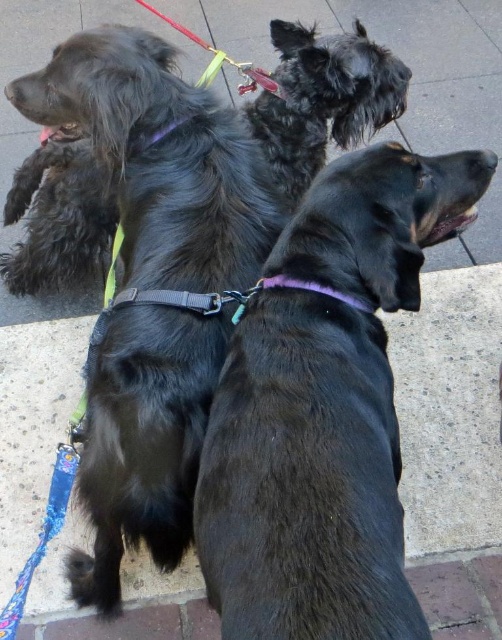
Question: Does shiny black fur at upper left have a lesser width compared to purple fabric neckband at center?

Choices:
 (A) yes
 (B) no

Answer: (B)

Question: Which point appears closest to the camera in this image?

Choices:
 (A) (310, 284)
 (B) (210, 45)
 (C) (326, 358)
 (D) (312, 51)

Answer: (C)

Question: Which point appears closest to the camera in this image?

Choices:
 (A) (228, 394)
 (B) (35, 168)
 (C) (319, 288)
 (D) (209, 72)

Answer: (A)

Question: Which point is closer to the camera taking this photo?

Choices:
 (A) (321, 241)
 (B) (168, 20)
 (C) (282, 76)
 (D) (355, 298)

Answer: (A)

Question: Is black matte dog at center to the left of shiny black fur at upper left from the viewer's perspective?

Choices:
 (A) yes
 (B) no

Answer: (B)

Question: Does black matte dog at center appear under yellow fabric leash at upper center?

Choices:
 (A) yes
 (B) no

Answer: (A)